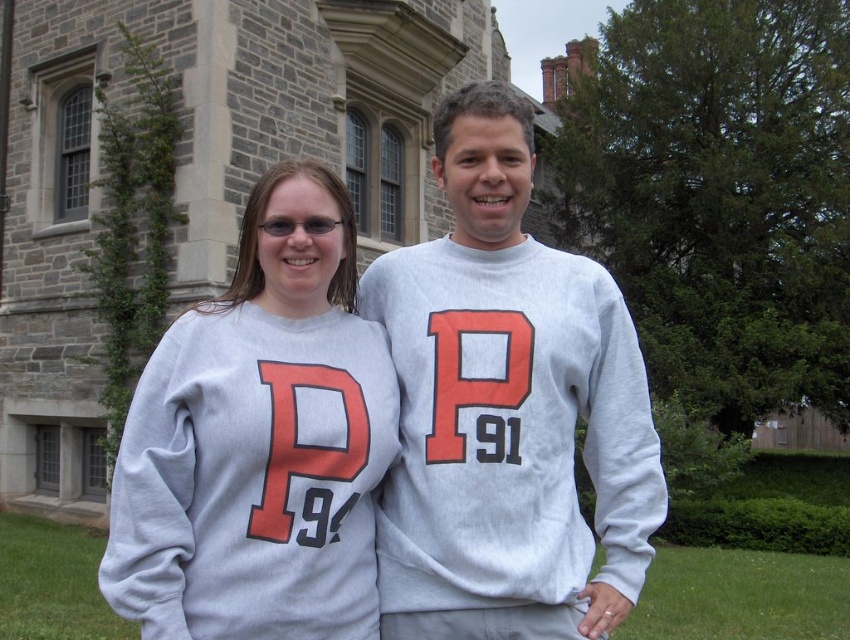
In the scene shown: You are a photographer trying to capture the gray cotton sweatshirt at center in the image. Based on the coordinates provided, where exactly should you focus your camera lens to ensure the sweatshirt is centered in the frame?

The gray cotton sweatshirt at center is located at coordinates point (x=507, y=410), so you should focus your camera lens precisely at that point to center it in the frame.

In the scene shown: You are a photographer taking a picture of two people wearing gray sweatshirts. You notice both are wearing the same style of shirt with red and black lettering. The scene shows a gray cotton sweatshirt at center and another gray sweatshirt at center. Which one is positioned to the right?

The gray cotton sweatshirt at center is positioned to the right of the gray sweatshirt at center.